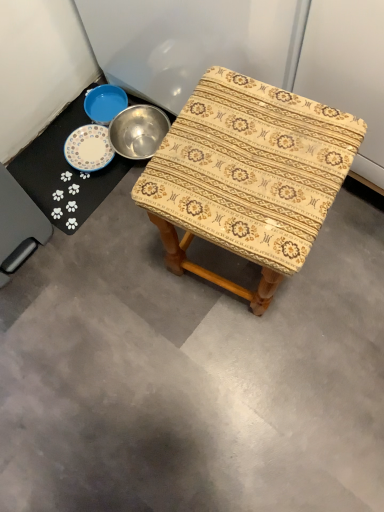
The width and height of the screenshot is (384, 512). Identify the location of vacant space situated on the left part of patterned fabric stool at center. [135, 287].